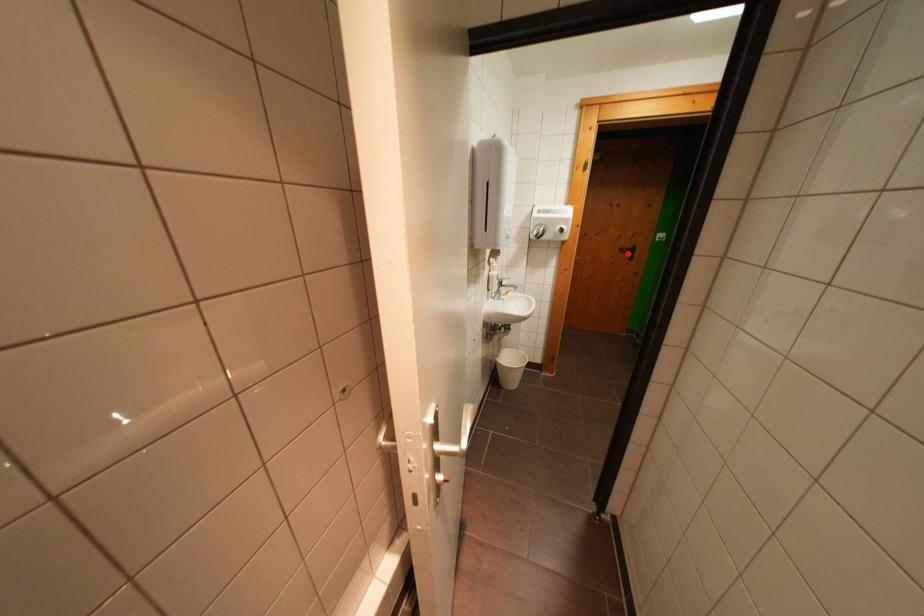
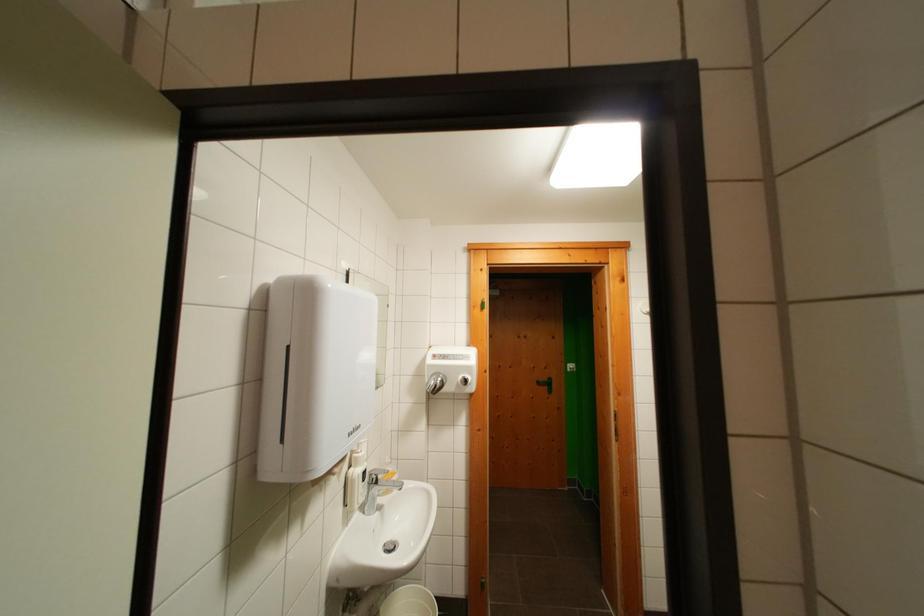
Question: I am providing you with two images of the same scene from different viewpoints. In image1, a red point is highlighted. Considering the same 3D point in image2, which of the following is correct?

Choices:
 (A) It is closer
 (B) It is farther

Answer: (B)